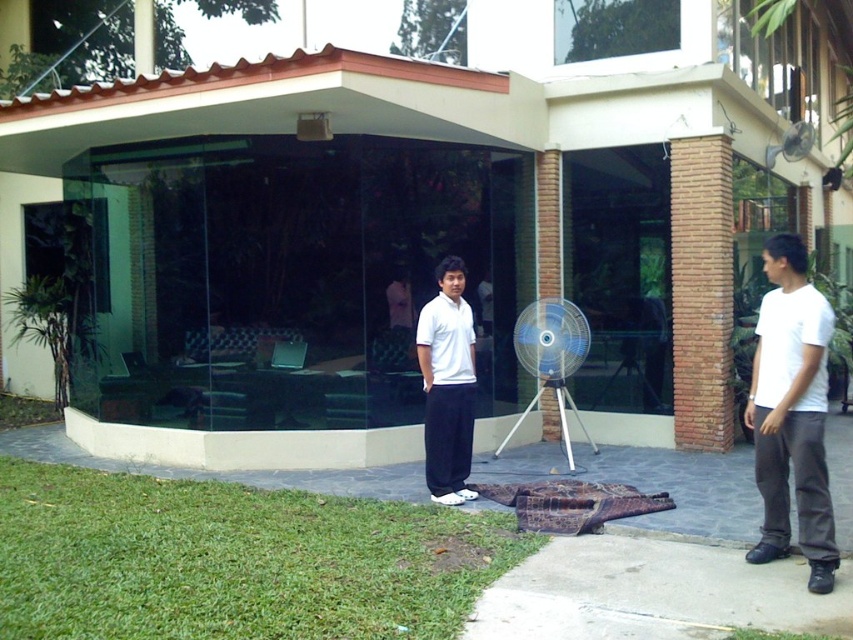
Does white matte shirt at center appear on the left side of metallic silver fan at upper right?

Yes, white matte shirt at center is to the left of metallic silver fan at upper right.

Which is in front, point (440, 387) or point (811, 138)?

Point (440, 387)

At what (x,y) coordinates should I click in order to perform the action: click on white matte shirt at center. Please return your answer as a coordinate pair (x, y). The width and height of the screenshot is (853, 640). Looking at the image, I should click on (447, 385).

Is white matte shirt at right above white matte shirt at center?

Incorrect, white matte shirt at right is not positioned above white matte shirt at center.

Between point (798, 273) and point (444, 384), which one is positioned behind?

The point (444, 384) is more distant.

Where is `white matte shirt at right`? Image resolution: width=853 pixels, height=640 pixels. white matte shirt at right is located at coordinates (791, 412).

Who is taller, white matte shirt at right or metallic silver fan at upper right?

white matte shirt at right is taller.

Is white matte shirt at right in front of metallic silver fan at upper right?

Yes, white matte shirt at right is closer to the viewer.

Where is `white matte shirt at right`? The image size is (853, 640). white matte shirt at right is located at coordinates (791, 412).

Where is `white matte shirt at right`? The height and width of the screenshot is (640, 853). white matte shirt at right is located at coordinates (791, 412).